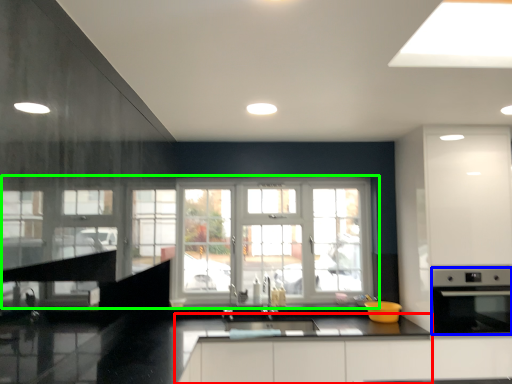
Question: Which is nearer to the counter top (highlighted by a red box)? appliance (highlighted by a blue box) or window (highlighted by a green box).

Choices:
 (A) appliance
 (B) window

Answer: (A)